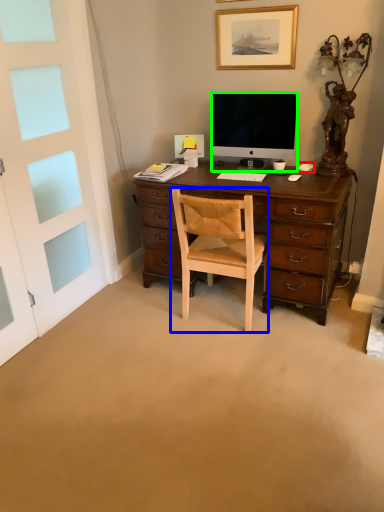
Question: Based on their relative distances, which object is nearer to computer mouse (highlighted by a red box)? Choose from chair (highlighted by a blue box) and television (highlighted by a green box).

Choices:
 (A) chair
 (B) television

Answer: (B)